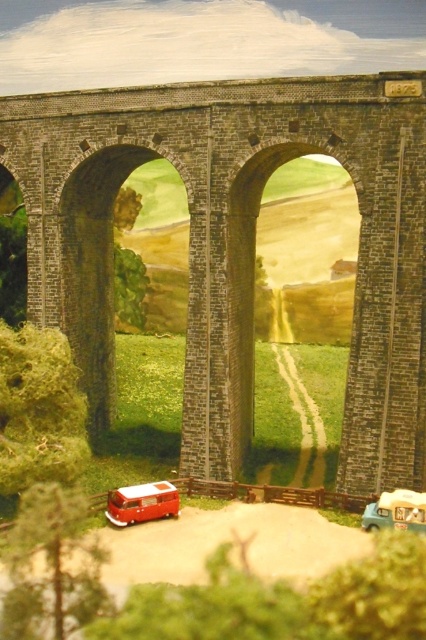
You are a delivery driver who needs to drive your matte white van at lower right through the brick stone bridge at center. Based on the scene description, can your van fit through the bridge?

The brick stone bridge at center is wider than the matte white van at lower right, so yes, the matte white van at lower right can fit through the bridge.

You are a model train enthusiast who wants to place a new toy car between the shiny red van at lower left and the matte white van at lower right on the dirt path. The toy car requires 1.2 meters of space to fit. Can you determine if there is enough space between the two vans?

The shiny red van at lower left is wider than the matte white van at lower right. However, the distance between them isn